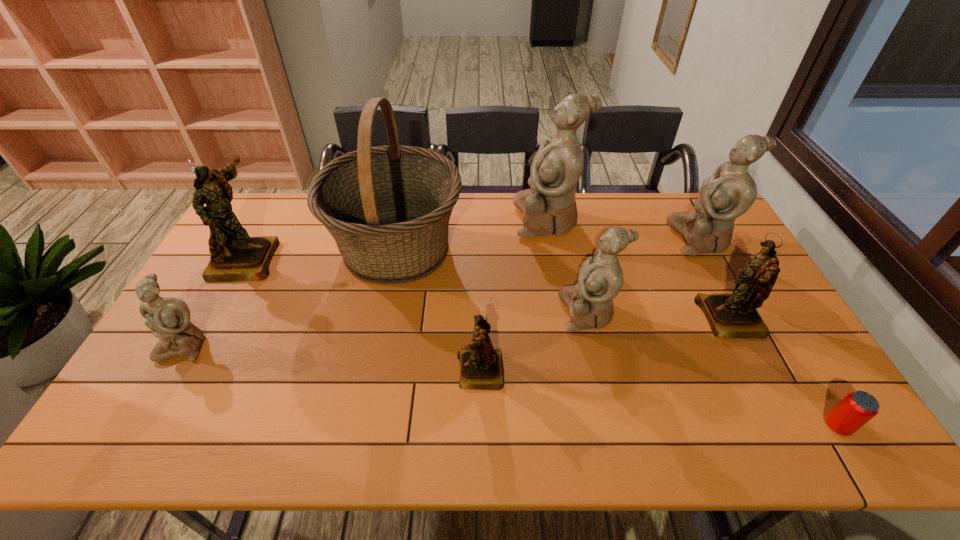
Where is `object identified as the fourth closest to the smallest white figurine`? This screenshot has height=540, width=960. object identified as the fourth closest to the smallest white figurine is located at coordinates (549, 207).

In order to click on figurine that can be found as the sixth closest to the basket in this screenshot , I will do `click(734, 315)`.

This screenshot has height=540, width=960. I want to click on figurine that stands as the sixth closest to the smallest gold figurine, so click(730, 191).

The width and height of the screenshot is (960, 540). Find the location of `the fourth closest white figurine to the leftmost gold figurine`. the fourth closest white figurine to the leftmost gold figurine is located at coordinates (730, 191).

This screenshot has width=960, height=540. Find the location of `white figurine that is the third nearest to the third biggest white figurine`. white figurine that is the third nearest to the third biggest white figurine is located at coordinates (168, 318).

At what (x,y) coordinates should I click in order to perform the action: click on gold figurine that is the closest one to the second smallest gold figurine. Please return your answer as a coordinate pair (x, y). The image size is (960, 540). Looking at the image, I should click on (481, 367).

Locate which gold figurine ranks in proximity to the farthest gold figurine. Please provide its 2D coordinates. Your answer should be formatted as a tuple, i.e. [(x, y)], where the tuple contains the x and y coordinates of a point satisfying the conditions above.

[(481, 367)]

This screenshot has height=540, width=960. What are the coordinates of `free location that satisfies the following two spatial constraints: 1. on the front-facing side of the second smallest white figurine; 2. on the back side of the can` in the screenshot? It's located at (613, 426).

In order to click on free spot that satisfies the following two spatial constraints: 1. on the front-facing side of the leftmost gold figurine; 2. on the back side of the nearest object in this screenshot , I will do `click(153, 426)`.

What are the coordinates of `blank space that satisfies the following two spatial constraints: 1. on the back side of the shortest object; 2. on the front-facing side of the rightmost white figurine` in the screenshot? It's located at (724, 239).